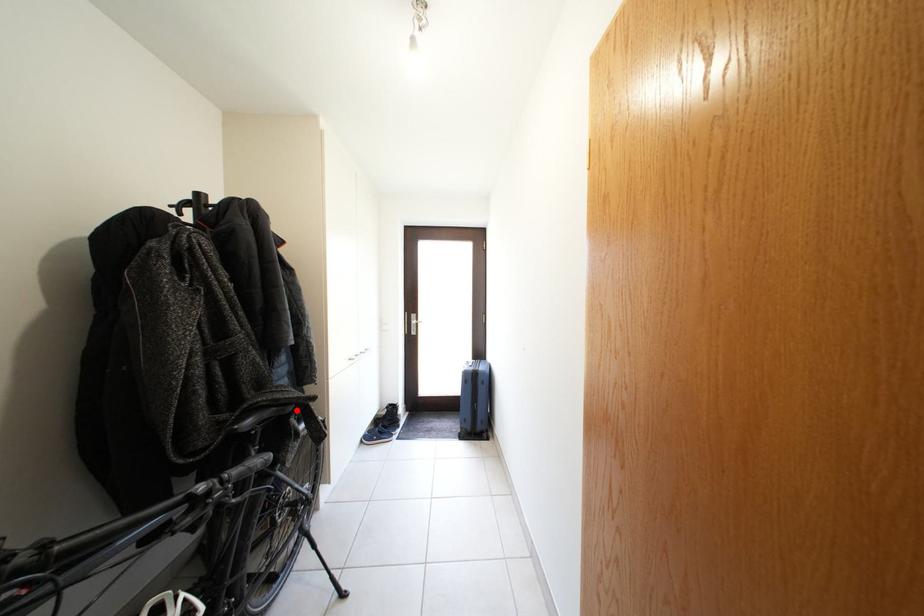
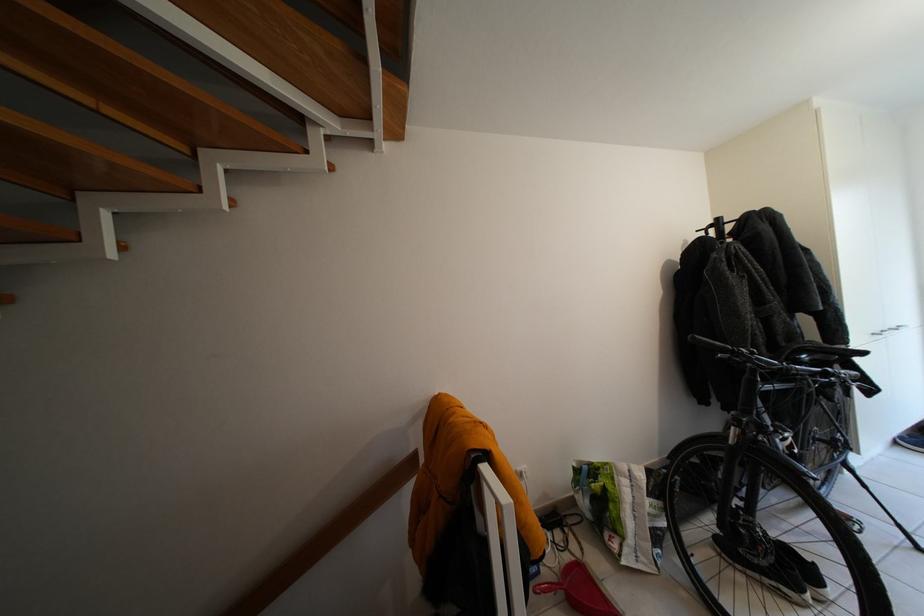
The point at the highlighted location is marked in the first image. Where is the corresponding point in the second image?

(841, 360)